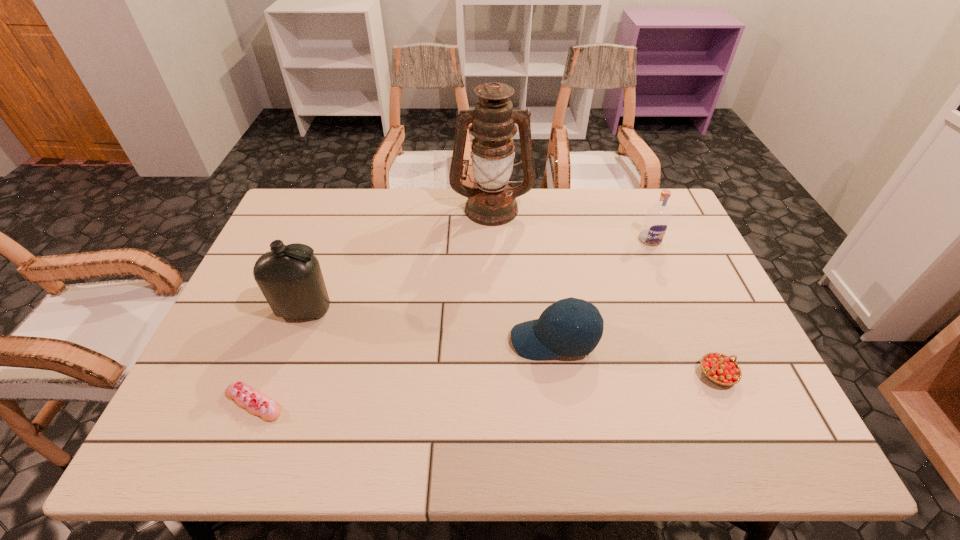
Image resolution: width=960 pixels, height=540 pixels. I want to click on object that is the third closest to the baseball cap, so click(x=491, y=202).

The height and width of the screenshot is (540, 960). I want to click on vacant region that satisfies the following two spatial constraints: 1. on the label of the vodka; 2. on the front-facing side of the third shortest object, so click(x=692, y=340).

The image size is (960, 540). I want to click on vacant region that satisfies the following two spatial constraints: 1. on the back side of the tallest object; 2. on the right side of the fifth shortest object, so click(343, 208).